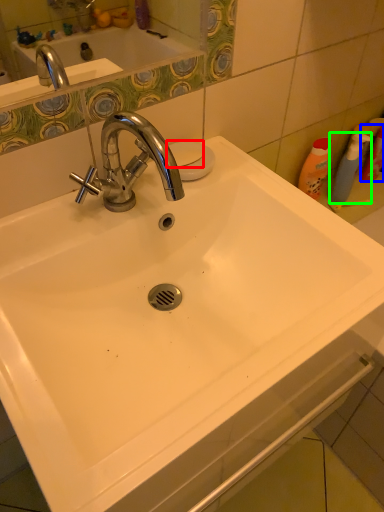
Question: Based on their relative distances, which object is farther from soap (highlighted by a red box)? Choose from cleaning product (highlighted by a blue box) and cleaning product (highlighted by a green box).

Choices:
 (A) cleaning product
 (B) cleaning product

Answer: (A)